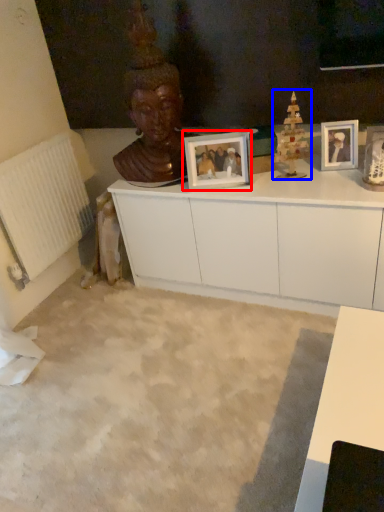
Question: Which of the following is the farthest to the observer, picture frame (highlighted by a red box) or toy (highlighted by a blue box)?

Choices:
 (A) picture frame
 (B) toy

Answer: (A)